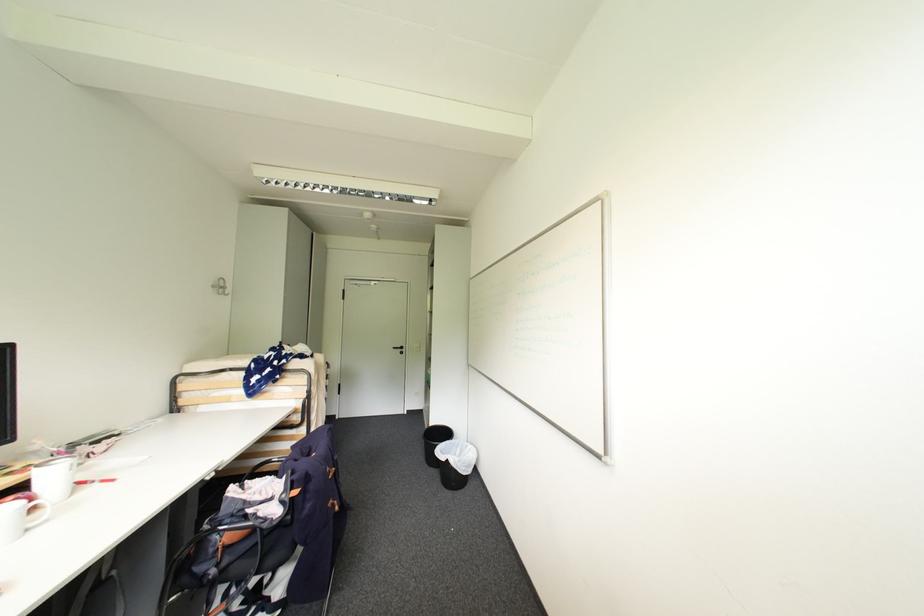
At what (x,y) coordinates should I click in order to perform the action: click on white light switch. Please return your answer as a coordinate pair (x, y). Looking at the image, I should click on (417, 346).